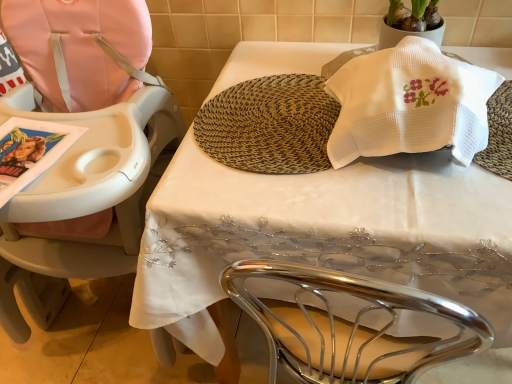
Question: From a real-world perspective, is pink fabric highchair at left beneath white waffle-textured towel at upper right?

Choices:
 (A) yes
 (B) no

Answer: (A)

Question: Does pink fabric highchair at left have a smaller size compared to white waffle-textured towel at upper right?

Choices:
 (A) yes
 (B) no

Answer: (B)

Question: Is the depth of pink fabric highchair at left greater than that of white waffle-textured towel at upper right?

Choices:
 (A) no
 (B) yes

Answer: (A)

Question: Is white waffle-textured towel at upper right inside pink fabric highchair at left?

Choices:
 (A) no
 (B) yes

Answer: (A)

Question: Is pink fabric highchair at left facing away from white waffle-textured towel at upper right?

Choices:
 (A) no
 (B) yes

Answer: (A)

Question: Does pink fabric highchair at left lie in front of white waffle-textured towel at upper right?

Choices:
 (A) yes
 (B) no

Answer: (A)

Question: Considering the relative sizes of pink fabric highchair at left and white embroidered tablecloth at center in the image provided, is pink fabric highchair at left taller than white embroidered tablecloth at center?

Choices:
 (A) no
 (B) yes

Answer: (B)

Question: From the image's perspective, is pink fabric highchair at left under white embroidered tablecloth at center?

Choices:
 (A) no
 (B) yes

Answer: (A)

Question: Does pink fabric highchair at left turn towards white embroidered tablecloth at center?

Choices:
 (A) yes
 (B) no

Answer: (B)

Question: Is pink fabric highchair at left outside of white embroidered tablecloth at center?

Choices:
 (A) no
 (B) yes

Answer: (B)

Question: Considering the relative positions of pink fabric highchair at left and white embroidered tablecloth at center in the image provided, is pink fabric highchair at left to the left of white embroidered tablecloth at center from the viewer's perspective?

Choices:
 (A) yes
 (B) no

Answer: (A)

Question: Can you confirm if pink fabric highchair at left is thinner than white embroidered tablecloth at center?

Choices:
 (A) yes
 (B) no

Answer: (B)

Question: Is pink fabric highchair at left directly adjacent to brown woven mat at center?

Choices:
 (A) yes
 (B) no

Answer: (B)